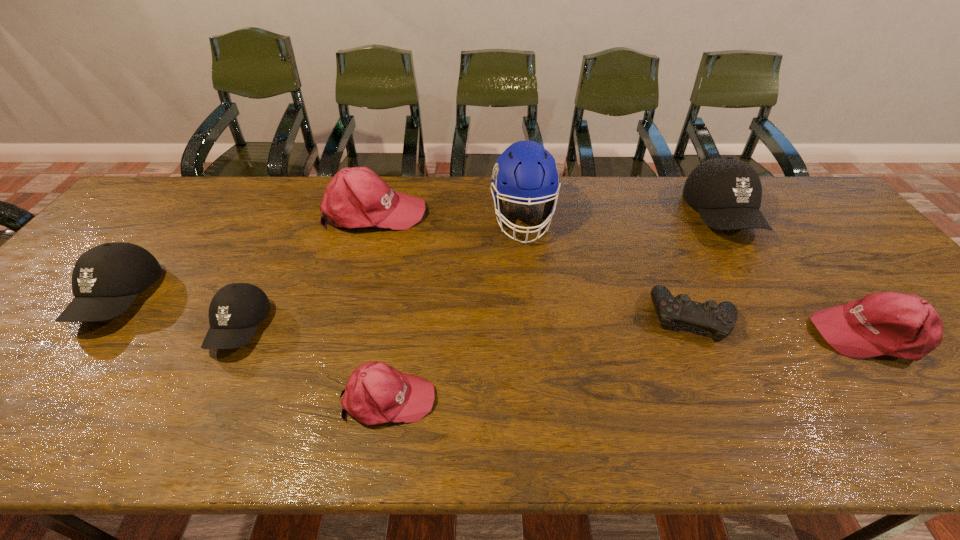
Identify the location of the tallest object. Image resolution: width=960 pixels, height=540 pixels. (525, 172).

Find the location of a particular element. The height and width of the screenshot is (540, 960). the fourth object from right to left is located at coordinates (525, 172).

Locate an element on the screen. The height and width of the screenshot is (540, 960). the farthest black baseball cap is located at coordinates (727, 192).

Find the location of a particular element. the rightmost black baseball cap is located at coordinates (727, 192).

In order to click on the farthest red baseball cap in this screenshot , I will do `click(356, 197)`.

Find the location of a particular element. Image resolution: width=960 pixels, height=540 pixels. the leftmost object is located at coordinates (106, 279).

The image size is (960, 540). In order to click on the leftmost baseball cap in this screenshot , I will do `click(106, 279)`.

Where is `the rightmost red baseball cap`? the rightmost red baseball cap is located at coordinates (906, 326).

The image size is (960, 540). I want to click on the second smallest red baseball cap, so click(x=906, y=326).

Where is `the second object from left to right`? The width and height of the screenshot is (960, 540). the second object from left to right is located at coordinates (235, 311).